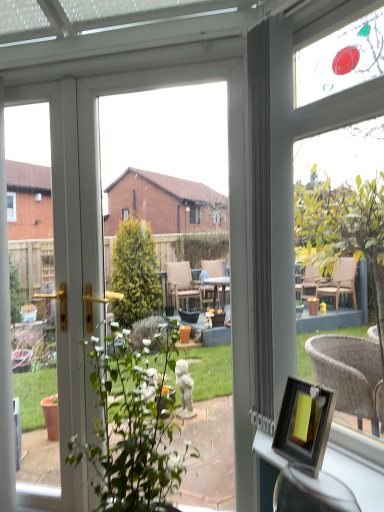
Question: Is the depth of wooden picture frame at lower right less than that of wooden frame at lower right?

Choices:
 (A) no
 (B) yes

Answer: (A)

Question: Can wooden frame at lower right be found inside wooden picture frame at lower right?

Choices:
 (A) no
 (B) yes

Answer: (B)

Question: Can you see wooden picture frame at lower right touching wooden frame at lower right?

Choices:
 (A) no
 (B) yes

Answer: (A)

Question: Could you tell me if wooden picture frame at lower right is turned towards wooden frame at lower right?

Choices:
 (A) yes
 (B) no

Answer: (B)

Question: Is wooden picture frame at lower right at the right side of wooden frame at lower right?

Choices:
 (A) no
 (B) yes

Answer: (B)

Question: From the image's perspective, is wooden picture frame at lower right beneath wooden frame at lower right?

Choices:
 (A) no
 (B) yes

Answer: (A)

Question: Considering the relative sizes of matte wicker chair at upper right and wooden frame at lower right in the image provided, is matte wicker chair at upper right shorter than wooden frame at lower right?

Choices:
 (A) yes
 (B) no

Answer: (B)

Question: Is matte wicker chair at upper right smaller than wooden frame at lower right?

Choices:
 (A) no
 (B) yes

Answer: (A)

Question: Does matte wicker chair at upper right appear on the left side of wooden frame at lower right?

Choices:
 (A) yes
 (B) no

Answer: (B)

Question: Is matte wicker chair at upper right at the right side of wooden frame at lower right?

Choices:
 (A) no
 (B) yes

Answer: (B)

Question: Does matte wicker chair at upper right touch wooden frame at lower right?

Choices:
 (A) no
 (B) yes

Answer: (A)

Question: Is the position of matte wicker chair at upper right less distant than that of wooden frame at lower right?

Choices:
 (A) no
 (B) yes

Answer: (A)

Question: Does wooden frame at lower right contain green leafy plant at center?

Choices:
 (A) yes
 (B) no

Answer: (B)